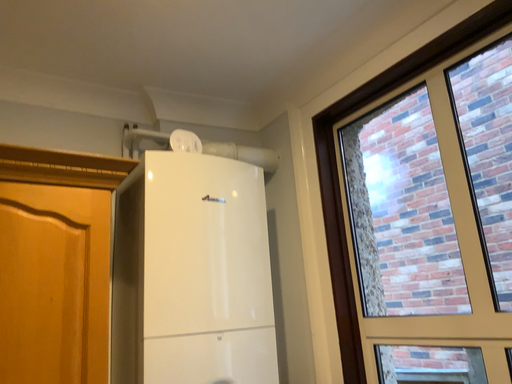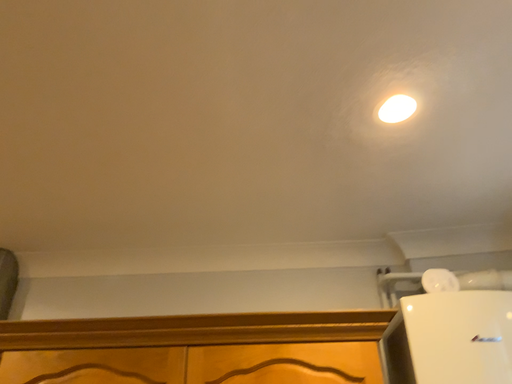
Question: How did the camera likely rotate when shooting the video?

Choices:
 (A) rotated downward
 (B) rotated upward

Answer: (B)